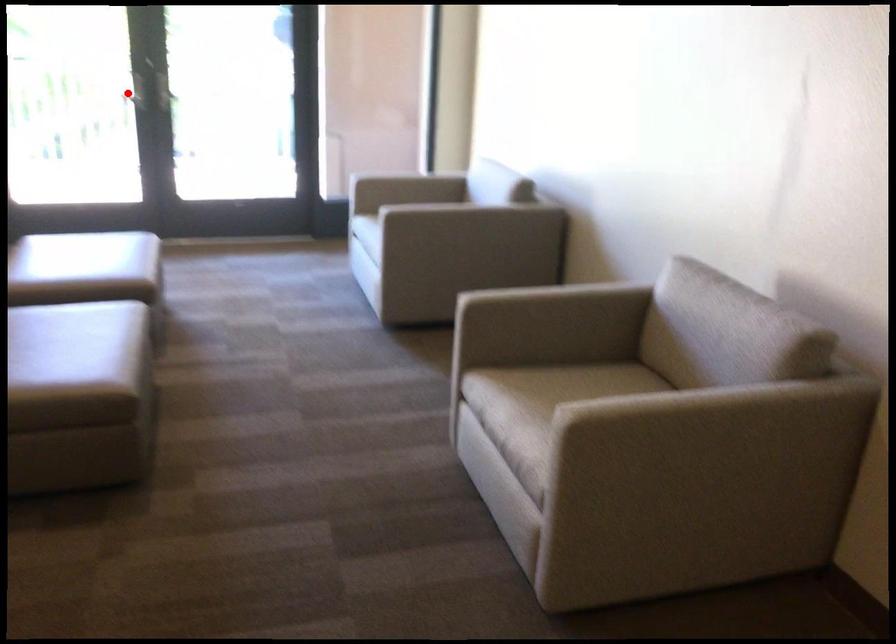
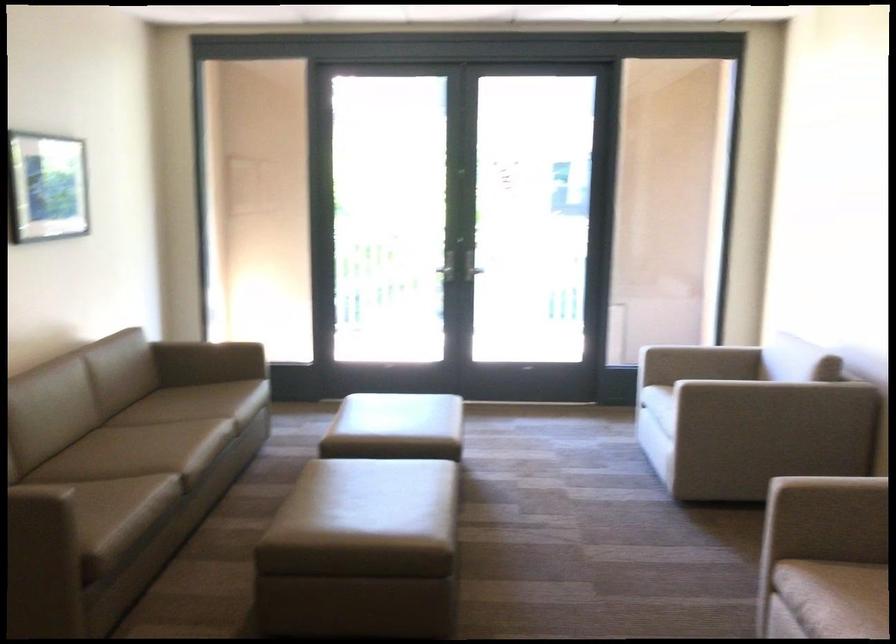
Where in the second image is the point corresponding to the highlighted location from the first image?

(444, 270)